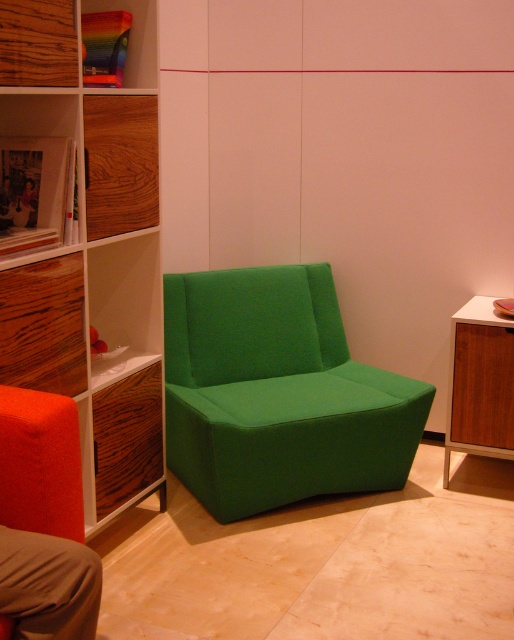
Question: Is green fabric armchair at center positioned in front of wooden cabinet at right?

Choices:
 (A) no
 (B) yes

Answer: (B)

Question: Which object is closer to the camera taking this photo?

Choices:
 (A) woodenmaterial/texturebookshelf at left
 (B) matte orange cushion at lower left
 (C) wooden cabinet at right

Answer: (B)

Question: Estimate the real-world distances between objects in this image. Which object is closer to the woodenmaterial/texturebookshelf at left?

Choices:
 (A) green fabric armchair at center
 (B) matte orange cushion at lower left

Answer: (B)

Question: Is green fabric armchair at center bigger than matte orange cushion at lower left?

Choices:
 (A) yes
 (B) no

Answer: (A)

Question: Which of the following is the farthest from the observer?

Choices:
 (A) green fabric armchair at center
 (B) woodenmaterial/texturebookshelf at left
 (C) matte orange cushion at lower left

Answer: (A)

Question: In this image, where is woodenmaterial/texturebookshelf at left located relative to green fabric armchair at center?

Choices:
 (A) right
 (B) left

Answer: (B)